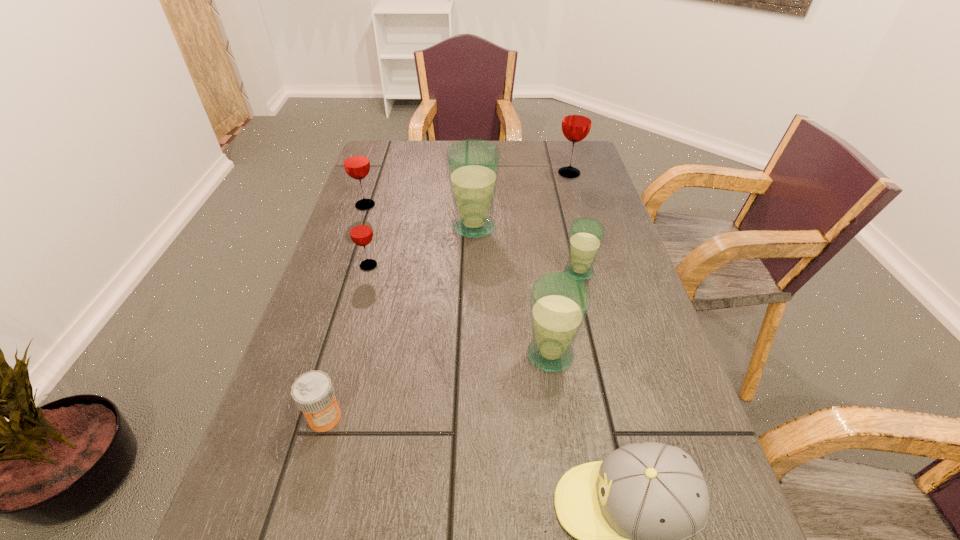
Locate an element on the screen. object present at the far edge is located at coordinates (576, 124).

Locate an element on the screen. Image resolution: width=960 pixels, height=540 pixels. medicine located at the left edge is located at coordinates (313, 392).

Identify the location of object present at the far right corner. Image resolution: width=960 pixels, height=540 pixels. (576, 124).

At what (x,y) coordinates should I click in order to perform the action: click on vacant space at the far edge. Please return your answer as a coordinate pair (x, y). Looking at the image, I should click on (516, 144).

Identify the location of vacant space at the left edge of the desktop. The image size is (960, 540). (379, 226).

In the image, there is a desktop. Where is `vacant space at the right edge`? The height and width of the screenshot is (540, 960). vacant space at the right edge is located at coordinates (632, 437).

Locate an element on the screen. The height and width of the screenshot is (540, 960). vacant region at the far left corner of the desktop is located at coordinates (383, 156).

Locate an element on the screen. This screenshot has height=540, width=960. vacant space that's between the fourth nearest glass and the rightmost red glass is located at coordinates (521, 200).

Locate an element on the screen. vacant area that lies between the farthest red glass and the seventh farthest object is located at coordinates (447, 295).

Locate an element on the screen. vacant space that's between the second nearest blue glass and the biggest blue glass is located at coordinates (526, 249).